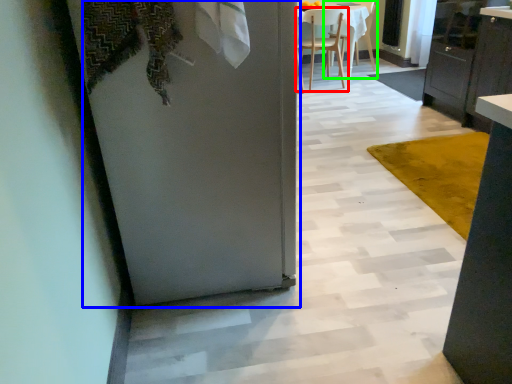
Question: Estimate the real-world distances between objects in this image. Which object is closer to chair (highlighted by a red box), door (highlighted by a blue box) or chair (highlighted by a green box)?

Choices:
 (A) door
 (B) chair

Answer: (B)